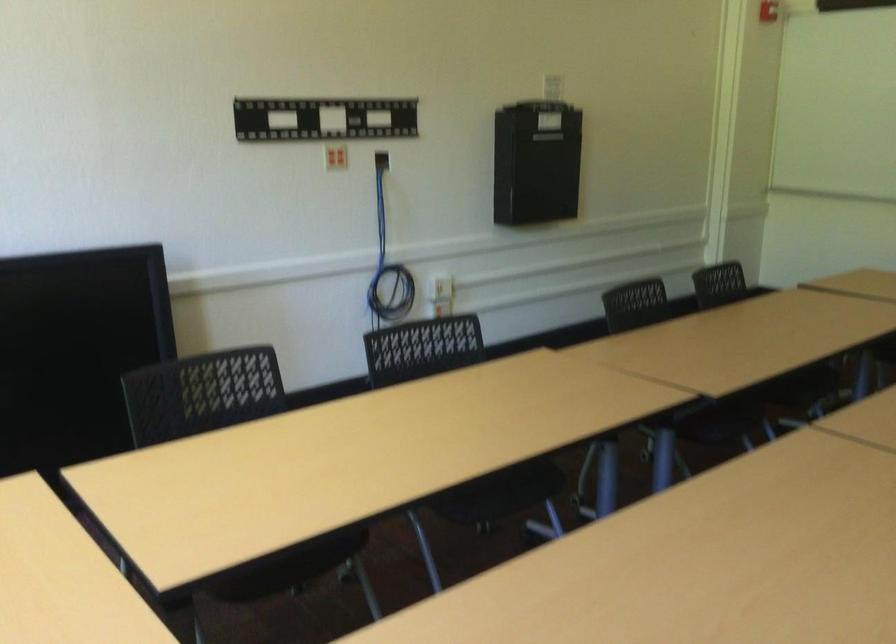
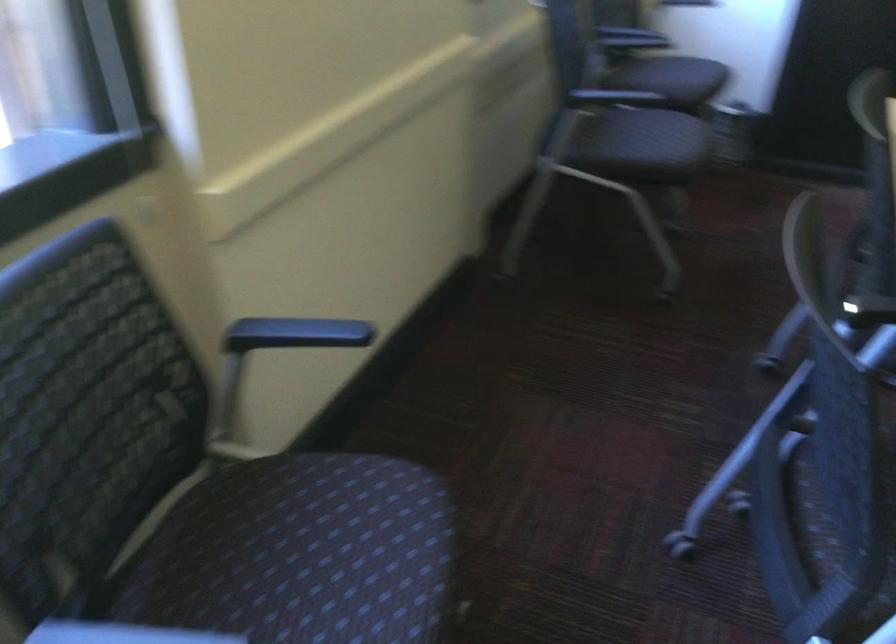
How did the camera likely rotate?

The camera's rotation is toward left-down.